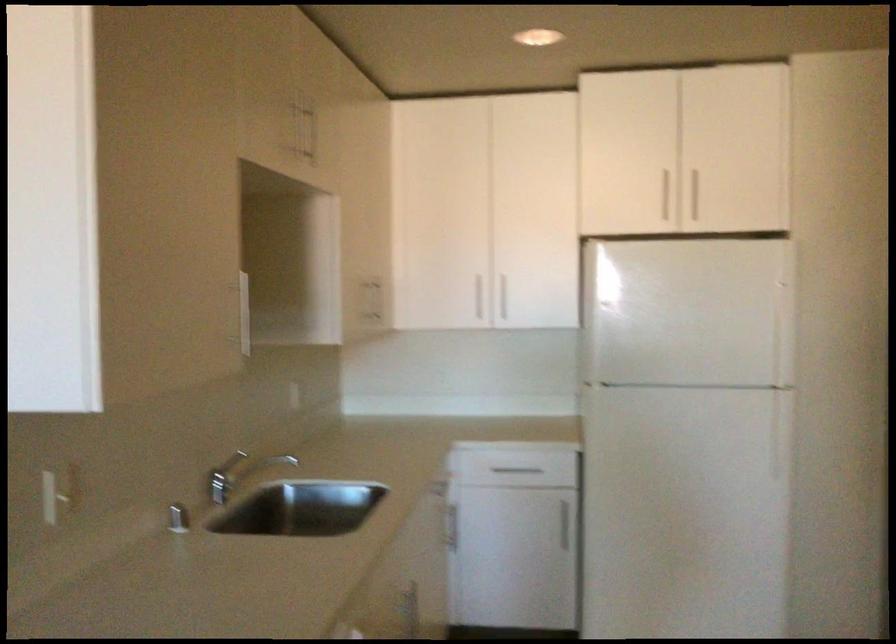
Where is `dispenser pump head`? Image resolution: width=896 pixels, height=644 pixels. dispenser pump head is located at coordinates (263, 467).